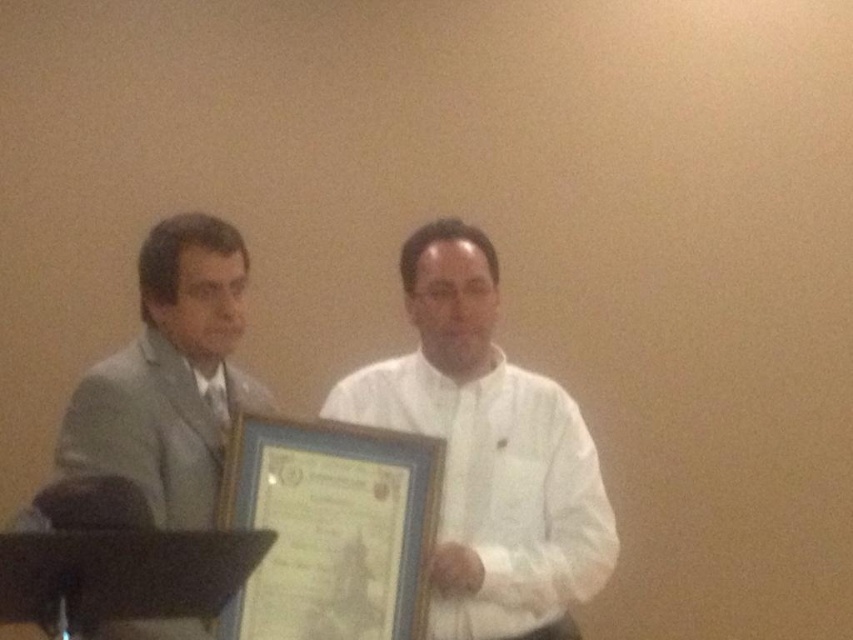
Which is more to the right, white matte shirt at center or light gray suit at left?

From the viewer's perspective, white matte shirt at center appears more on the right side.

I want to click on white matte shirt at center, so click(488, 452).

Is point (495, 516) behind point (204, 340)?

That is True.

Locate an element on the screen. This screenshot has height=640, width=853. white matte shirt at center is located at coordinates (488, 452).